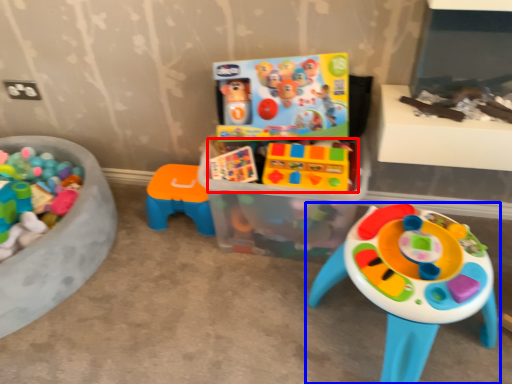
Question: Which object appears farthest to the camera in this image, toy (highlighted by a red box) or toy (highlighted by a blue box)?

Choices:
 (A) toy
 (B) toy

Answer: (A)